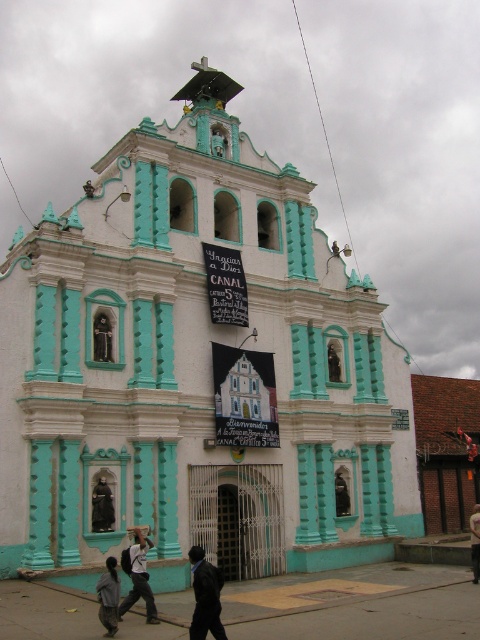
Question: Which point appears closest to the camera in this image?

Choices:
 (A) (97, 508)
 (B) (124, 552)

Answer: (B)

Question: Among these objects, which one is nearest to the camera?

Choices:
 (A) white cotton shirt at center
 (B) dark gray fabric jacket at lower left

Answer: (B)

Question: Is dark gray fabric jacket at lower left positioned before black fabric at center?

Choices:
 (A) no
 (B) yes

Answer: (B)

Question: Does matte black statue at lower left appear on the left side of black fabric at center?

Choices:
 (A) yes
 (B) no

Answer: (A)

Question: Can you confirm if white cotton shirt at center is positioned to the left of dark gray fabric jacket at lower left?

Choices:
 (A) yes
 (B) no

Answer: (B)

Question: Which is farther from the black matte jacket at lower center?

Choices:
 (A) dark gray fabric jacket at lower left
 (B) black fabric at center
 (C) matte black statue at lower left
 (D) white cotton shirt at center

Answer: (B)